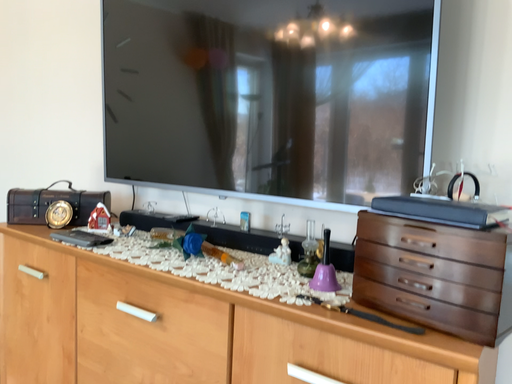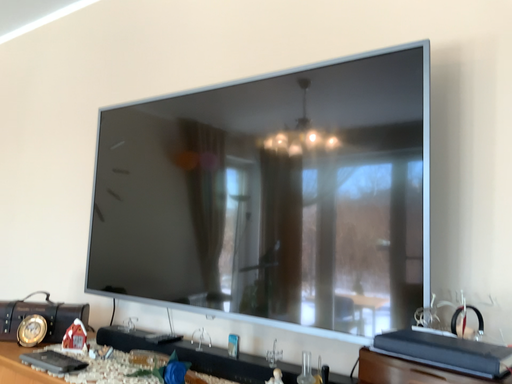
Question: Which way did the camera rotate in the video?

Choices:
 (A) rotated upward
 (B) rotated downward

Answer: (A)